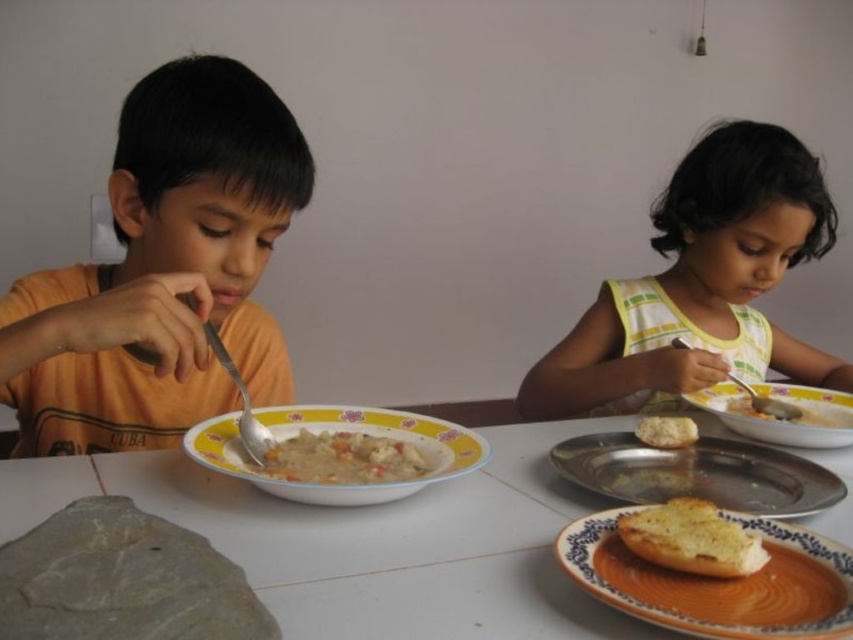
Based on the photo, you are a waiter in a restaurant and you need to clear the dishes from the table. You see the metallic silver plate at lower right and the matte ceramic bowl at lower right. Which one is closer to the edge of the table?

The metallic silver plate at lower right is located below the matte ceramic bowl at lower right, meaning it is closer to the edge of the table since it is positioned lower.